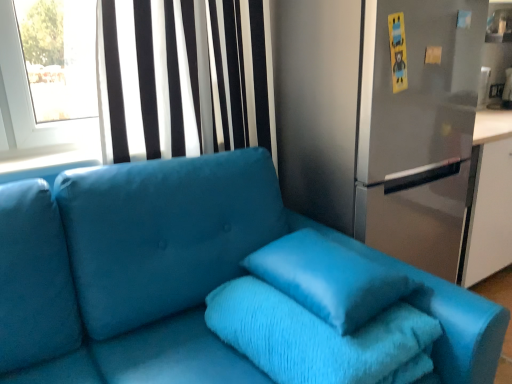
This screenshot has height=384, width=512. What do you see at coordinates (319, 338) in the screenshot?
I see `turquoise plush bath towel at center` at bounding box center [319, 338].

Consider the image. Measure the distance between satin silver fridge at center and camera.

1.24 meters.

Where is `turquoise plush bath towel at center`? The height and width of the screenshot is (384, 512). turquoise plush bath towel at center is located at coordinates (319, 338).

From a real-world perspective, is satin black curtain at upper left over satin blue couch at center?

Correct, in the physical world, satin black curtain at upper left is higher than satin blue couch at center.

Consider the image. Is satin blue couch at center at the back of satin black curtain at upper left?

No, satin black curtain at upper left is not facing the opposite direction of satin blue couch at center.

From the image's perspective, is satin black curtain at upper left on satin blue couch at center?

Indeed, from the image's perspective, satin black curtain at upper left is shown above satin blue couch at center.

This screenshot has width=512, height=384. I want to click on studio couch below the turquoise plush bath towel at center (from a real-world perspective), so click(181, 277).

Would you say satin blue couch at center is part of turquoise plush bath towel at center's contents?

No, satin blue couch at center is not a part of turquoise plush bath towel at center.

Considering the relative positions of turquoise plush bath towel at center and satin blue couch at center in the image provided, is turquoise plush bath towel at center to the left or to the right of satin blue couch at center?

Clearly, turquoise plush bath towel at center is on the right of satin blue couch at center in the image.

From a real-world perspective, is turquoise plush bath towel at center above or below satin blue couch at center?

From a real-world perspective, turquoise plush bath towel at center is physically above satin blue couch at center.

Is satin blue couch at center smaller than satin black curtain at upper left?

No.

Is the position of satin blue couch at center less distant than that of satin black curtain at upper left?

Yes, it is in front of satin black curtain at upper left.

Does point (97, 232) come closer to viewer compared to point (177, 44)?

Yes, it is.

Looking at their sizes, would you say satin blue couch at center is wider or thinner than satin black curtain at upper left?

satin blue couch at center is wider than satin black curtain at upper left.

Considering the sizes of objects satin blue pillow at center and satin black curtain at upper left in the image provided, who is taller, satin blue pillow at center or satin black curtain at upper left?

satin black curtain at upper left is taller.

From the image's perspective, between satin blue pillow at center and satin black curtain at upper left, who is located below?

From the image's view, satin blue pillow at center is below.

From a real-world perspective, is satin blue pillow at center above or below satin black curtain at upper left?

Clearly, from a real-world perspective, satin blue pillow at center is below satin black curtain at upper left.

Between turquoise plush bath towel at center and satin silver fridge at center, which one is positioned behind?

satin silver fridge at center is further from the camera.

From the image's perspective, who appears lower, turquoise plush bath towel at center or satin silver fridge at center?

turquoise plush bath towel at center, from the image's perspective.

Would you say turquoise plush bath towel at center is inside or outside satin silver fridge at center?

turquoise plush bath towel at center cannot be found inside satin silver fridge at center.

Between turquoise plush bath towel at center and satin silver fridge at center, which one has smaller size?

turquoise plush bath towel at center.

Is satin blue pillow at center at the back of satin blue couch at center?

Yes, satin blue couch at center is positioned with its back facing satin blue pillow at center.

Looking at this image, would you consider satin blue couch at center to be distant from satin blue pillow at center?

No.

Is point (246, 246) closer or farther from the camera than point (330, 304)?

Point (246, 246) appears to be farther away from the viewer than point (330, 304).

Looking at their sizes, would you say turquoise plush bath towel at center is wider or thinner than satin blue pillow at center?

Clearly, turquoise plush bath towel at center has more width compared to satin blue pillow at center.

From the picture: Is turquoise plush bath towel at center at the left side of satin blue pillow at center?

Indeed, turquoise plush bath towel at center is positioned on the left side of satin blue pillow at center.

From the image's perspective, who appears lower, turquoise plush bath towel at center or satin blue pillow at center?

turquoise plush bath towel at center appears lower in the image.

You are a GUI agent. You are given a task and a screenshot of the screen. Output one action in this format:
    pyautogui.click(x=<x>, y=<y>)
    Task: Click on the studio couch below the satin black curtain at upper left (from the image's perspective)
    This screenshot has width=512, height=384.
    Given the screenshot: What is the action you would take?
    pyautogui.click(x=181, y=277)

Identify the location of studio couch on the left of the turquoise plush bath towel at center. This screenshot has width=512, height=384. (181, 277).

From the image, which object appears to be farther from satin blue couch at center, satin silver fridge at center or turquoise plush bath towel at center?

satin silver fridge at center is positioned further to the anchor satin blue couch at center.

Looking at the image, which one is located further to satin blue couch at center, turquoise plush bath towel at center or satin silver fridge at center?

satin silver fridge at center lies further to satin blue couch at center than the other object.

Which object lies further to the anchor point satin silver fridge at center, satin blue couch at center or turquoise plush bath towel at center?

turquoise plush bath towel at center is further to satin silver fridge at center.

When comparing their distances from satin silver fridge at center, does satin black curtain at upper left or satin blue couch at center seem closer?

satin black curtain at upper left.

When comparing their distances from satin blue couch at center, does satin black curtain at upper left or turquoise plush bath towel at center seem further?

Among the two, satin black curtain at upper left is located further to satin blue couch at center.

When comparing their distances from turquoise plush bath towel at center, does satin blue couch at center or satin black curtain at upper left seem further?

satin black curtain at upper left.

From the image, which object appears to be nearer to satin black curtain at upper left, turquoise plush bath towel at center or satin silver fridge at center?

satin silver fridge at center.

Which object lies further to the anchor point satin silver fridge at center, satin black curtain at upper left or turquoise plush bath towel at center?

turquoise plush bath towel at center is further to satin silver fridge at center.

Image resolution: width=512 pixels, height=384 pixels. I want to click on bath towel located between satin black curtain at upper left and satin silver fridge at center in the left-right direction, so click(319, 338).

In order to click on bath towel between satin blue couch at center and satin black curtain at upper left along the z-axis in this screenshot , I will do `click(319, 338)`.

Where is `bath towel between satin blue couch at center and satin silver fridge at center along the z-axis`? Image resolution: width=512 pixels, height=384 pixels. bath towel between satin blue couch at center and satin silver fridge at center along the z-axis is located at coordinates (319, 338).

The image size is (512, 384). Identify the location of bath towel between satin blue couch at center and satin blue pillow at center in the front-back direction. (319, 338).